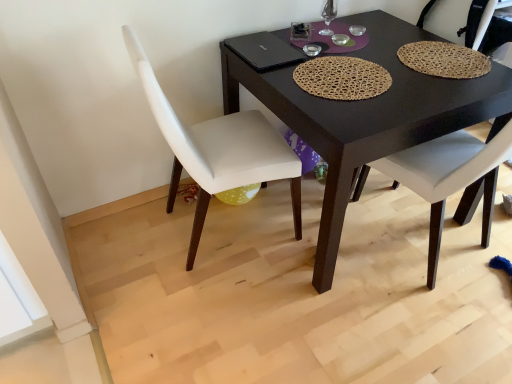
The image size is (512, 384). What are the coordinates of `vacant space in front of white leather chair at lower left, the 2th chair when ordered from right to left` in the screenshot? It's located at (223, 311).